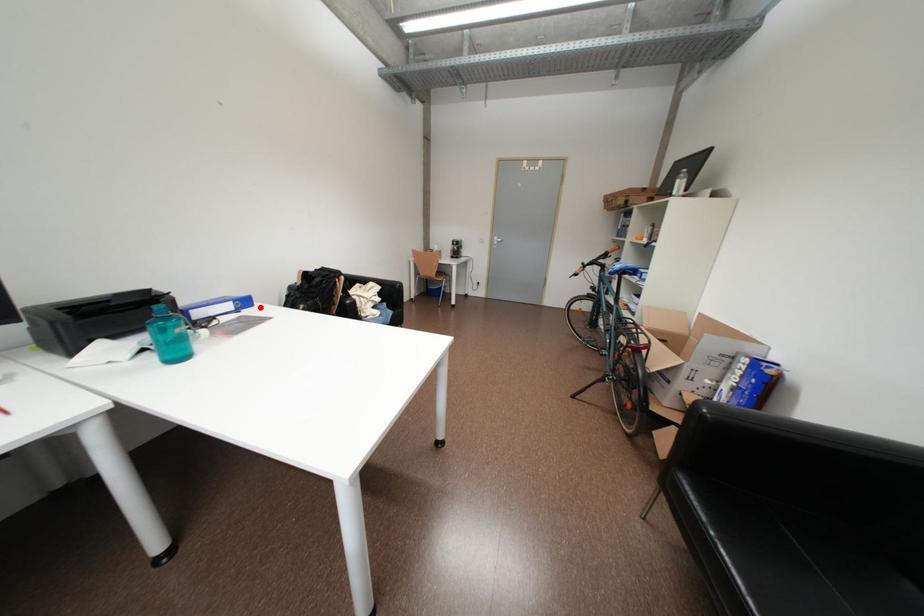
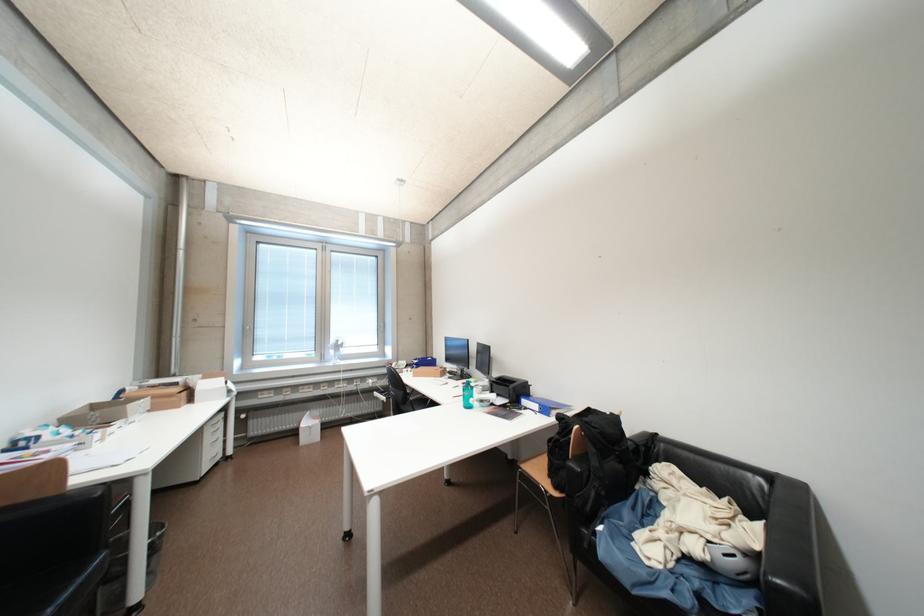
Question: I am providing you with two images of the same scene from different viewpoints. A red point is marked on the first image. Can you still see the location of the red point in image 2?

Choices:
 (A) Yes
 (B) No

Answer: (A)